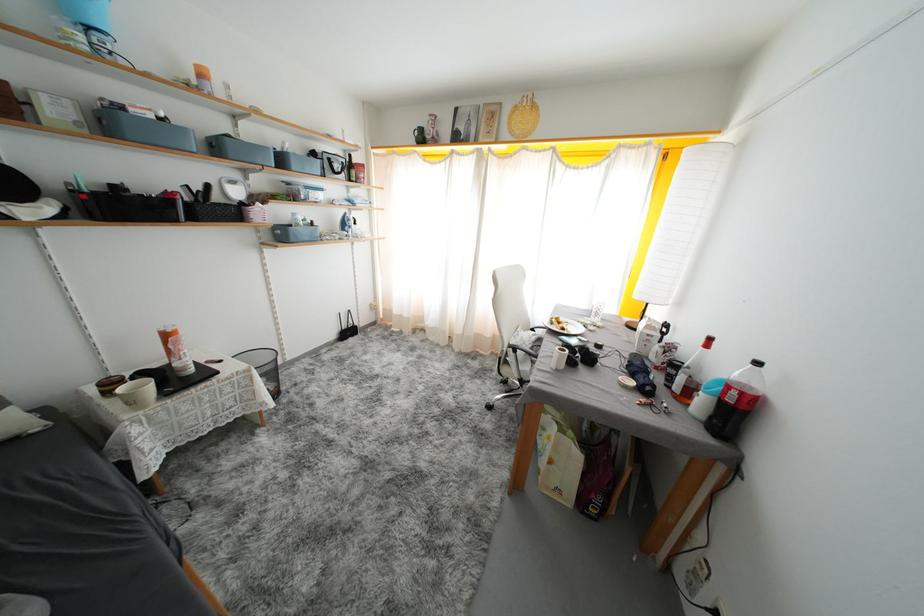
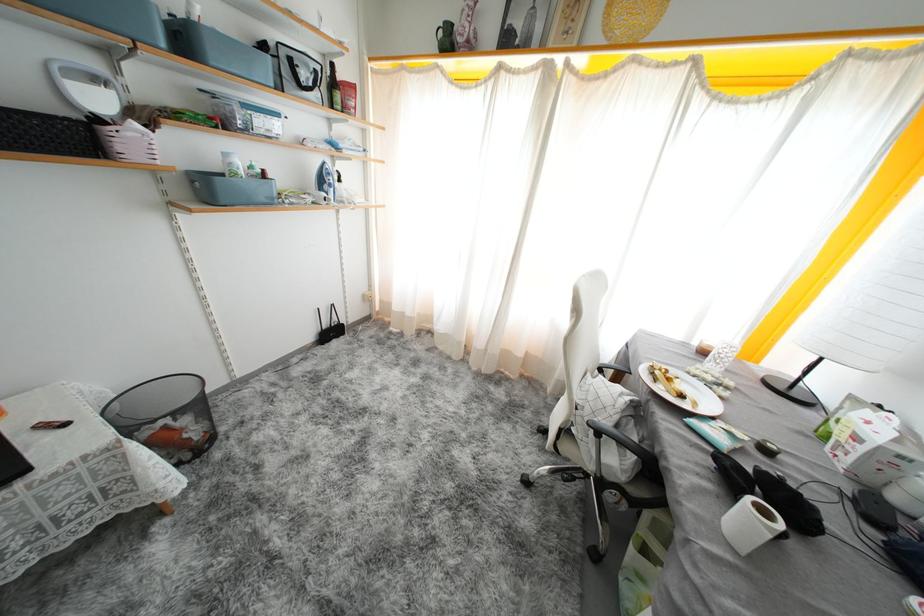
In the second image, find the point that corresponds to (x=288, y=164) in the first image.

(190, 44)